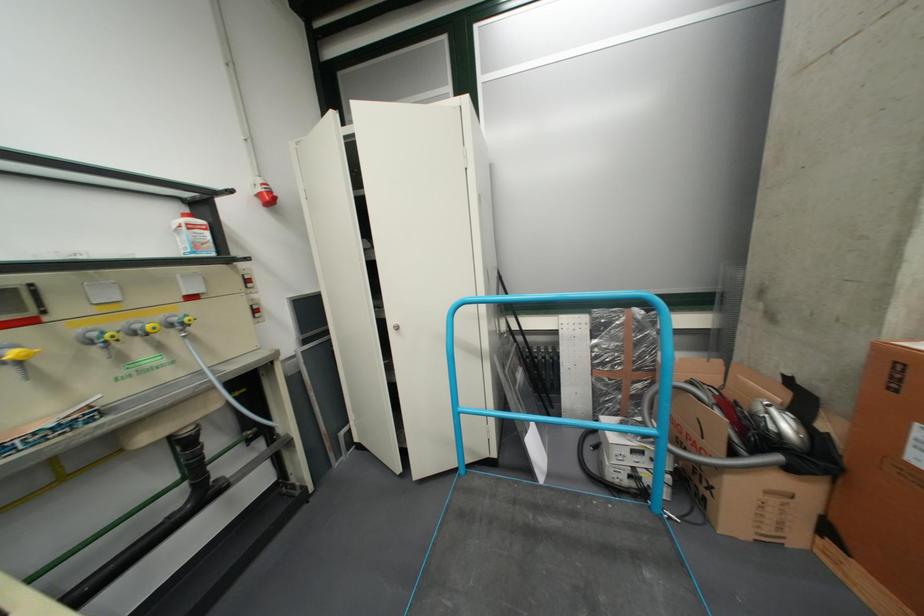
The image size is (924, 616). Describe the element at coordinates (263, 192) in the screenshot. I see `the red socket cover` at that location.